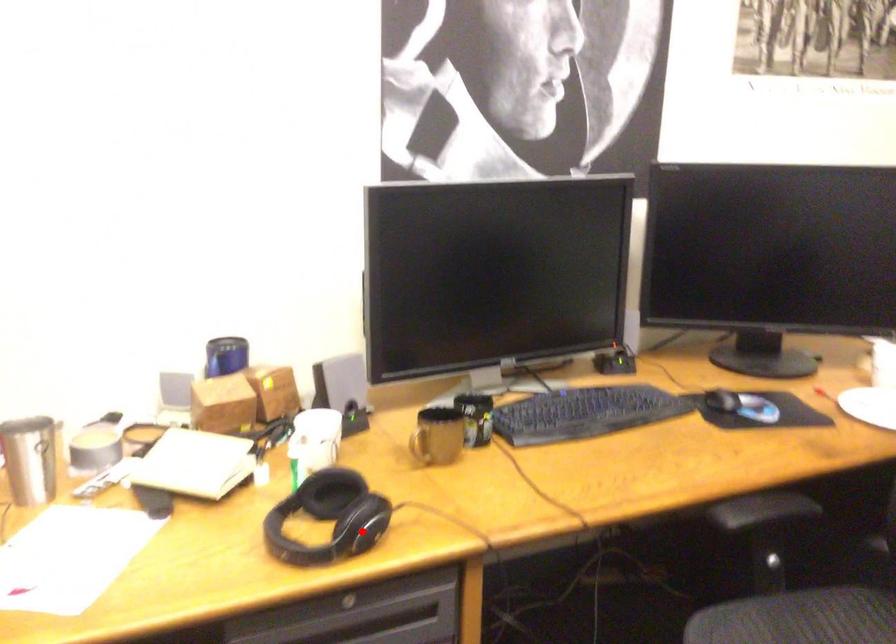
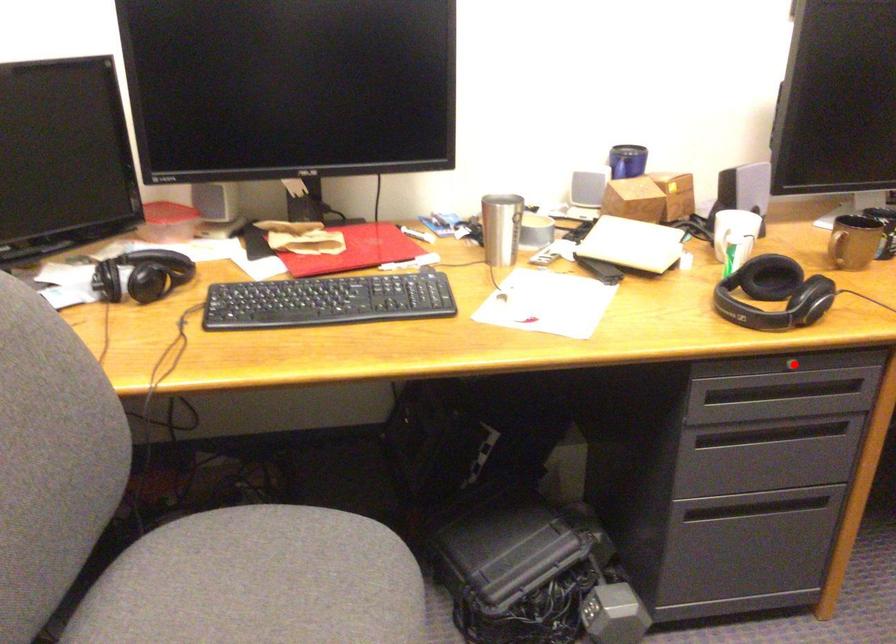
I am providing you with two images of the same scene from different viewpoints. A red point is marked on the first image and another point is marked on the second image. Does the point marked in image1 correspond to the same location as the one in image2?

No